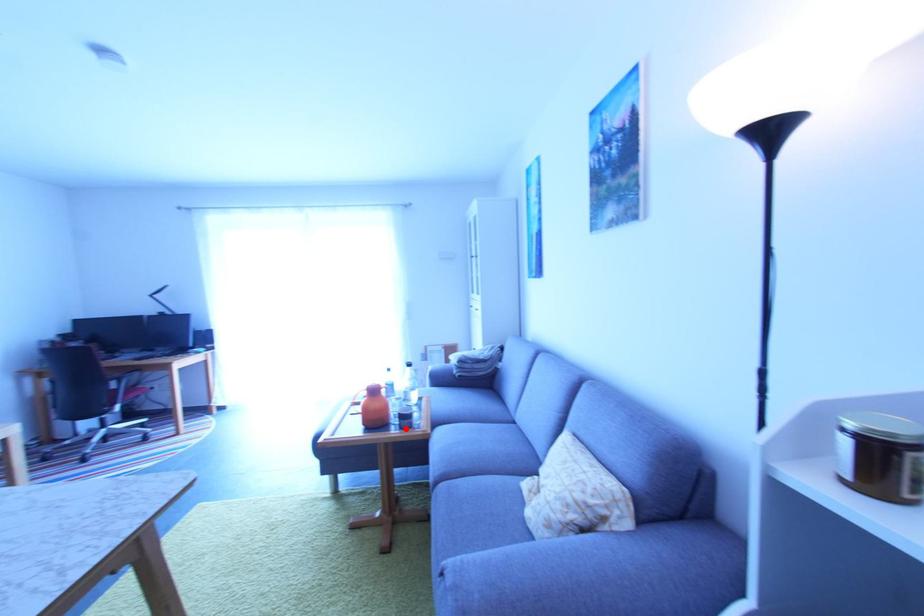
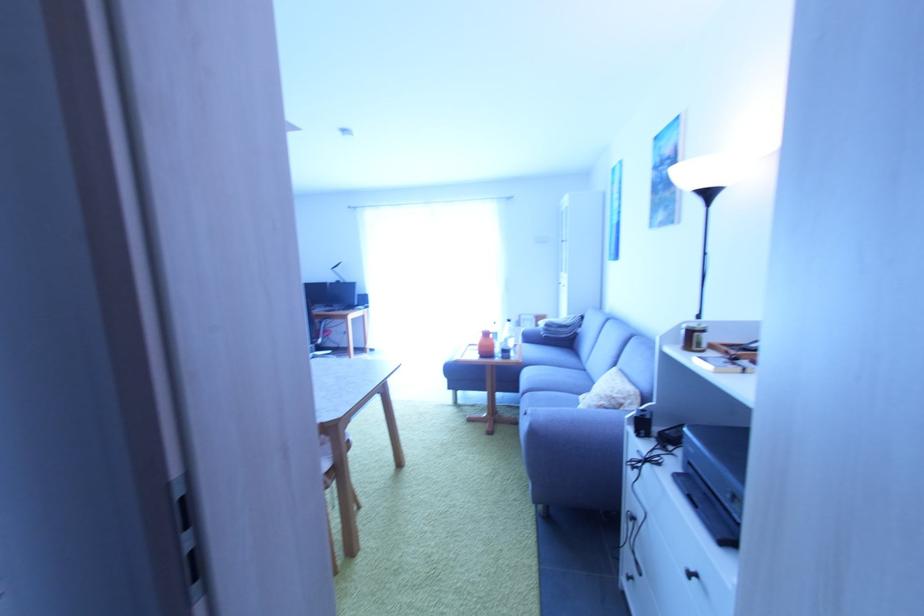
The point at the highlighted location is marked in the first image. Where is the corresponding point in the second image?

(507, 360)